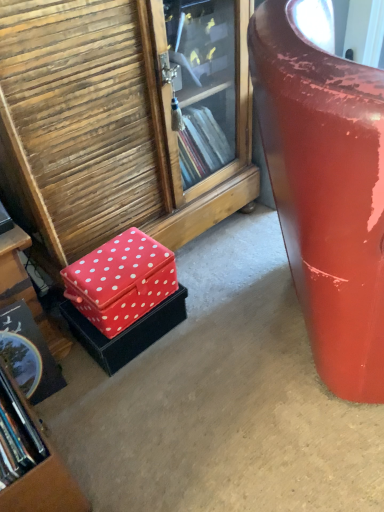
I want to click on vacant space to the right of red fabric box at lower left, the 2th box positioned from the top, so click(211, 327).